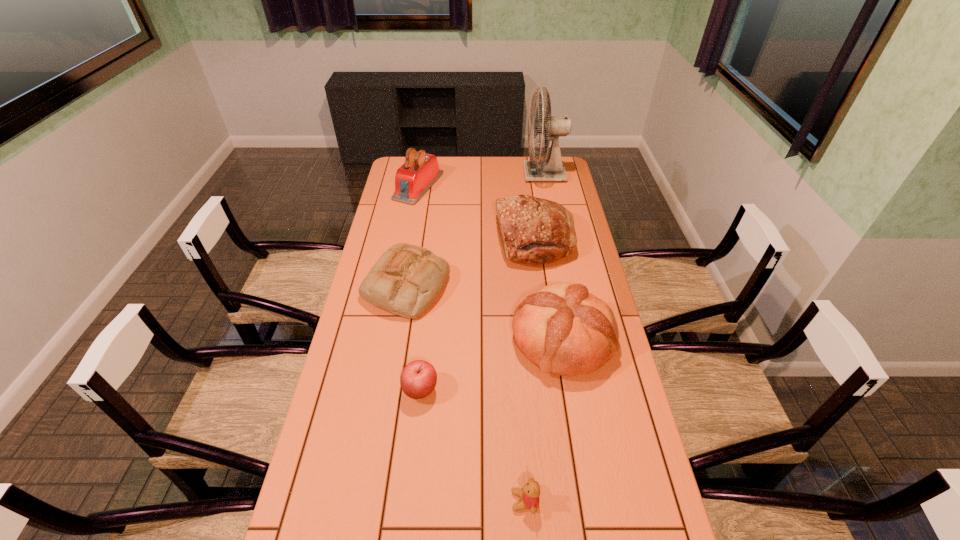
This screenshot has height=540, width=960. I want to click on free space located 0.210m on the back of the leftmost bread, so click(417, 224).

Find the location of a particular element. The image size is (960, 540). vacant space situated on the back of the apple is located at coordinates (425, 351).

Find the location of a particular element. free space located on the front-facing side of the nearest object is located at coordinates (360, 501).

In order to click on blank area located 0.170m on the front-facing side of the nearest object in this screenshot , I will do `click(444, 501)`.

This screenshot has height=540, width=960. In order to click on vacant space located on the front-facing side of the nearest object in this screenshot , I will do `click(432, 501)`.

You are a GUI agent. You are given a task and a screenshot of the screen. Output one action in this format:
    pyautogui.click(x=<x>, y=<y>)
    Task: Click on the fan located at the far edge
    Image resolution: width=960 pixels, height=540 pixels.
    Given the screenshot: What is the action you would take?
    pyautogui.click(x=552, y=169)

The image size is (960, 540). Identify the location of toaster that is at the far edge. point(415,177).

The image size is (960, 540). I want to click on toaster present at the left edge, so click(415, 177).

Where is `bread present at the left edge`? Image resolution: width=960 pixels, height=540 pixels. bread present at the left edge is located at coordinates (406, 280).

Find the location of a particular element. fan situated at the right edge is located at coordinates (552, 169).